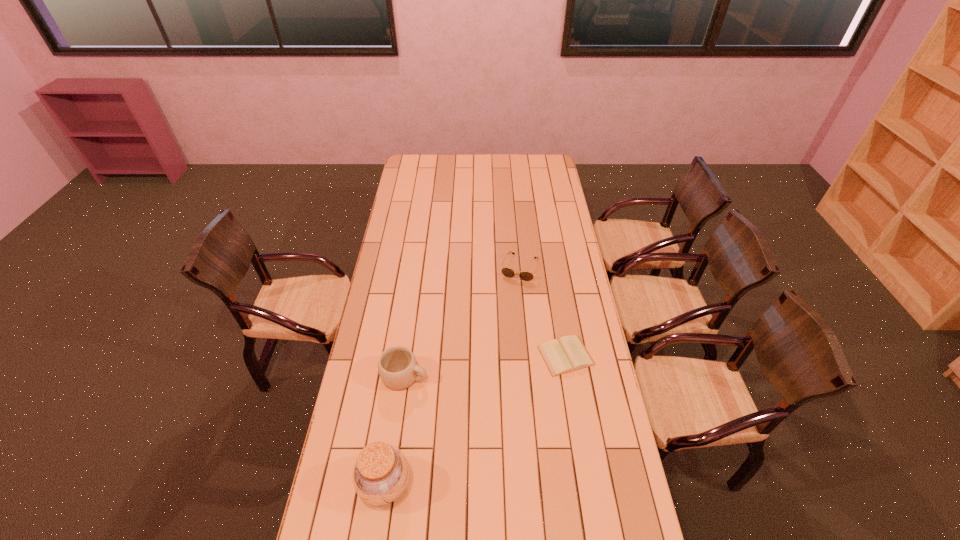
Find the location of a particular element. This screenshot has width=960, height=540. vacant space located on the side of the third shortest object with the handle is located at coordinates (481, 395).

This screenshot has width=960, height=540. What are the coordinates of `blank space located on the lenses of the second shortest object` in the screenshot? It's located at (511, 295).

Where is `free point located on the lenses of the second shortest object`? free point located on the lenses of the second shortest object is located at coordinates (504, 314).

Where is `free location located 0.220m on the lenses of the second shortest object`? The height and width of the screenshot is (540, 960). free location located 0.220m on the lenses of the second shortest object is located at coordinates (503, 317).

Where is `object that is at the near edge`? The height and width of the screenshot is (540, 960). object that is at the near edge is located at coordinates (381, 472).

Where is `jar present at the left edge`? This screenshot has width=960, height=540. jar present at the left edge is located at coordinates (381, 472).

Locate an element on the screen. mug located at the left edge is located at coordinates (397, 366).

In order to click on object present at the right edge in this screenshot , I will do `click(569, 354)`.

The image size is (960, 540). I want to click on object located in the near left corner section of the desktop, so click(x=381, y=472).

Locate an element on the screen. vacant point at the far edge is located at coordinates (435, 154).